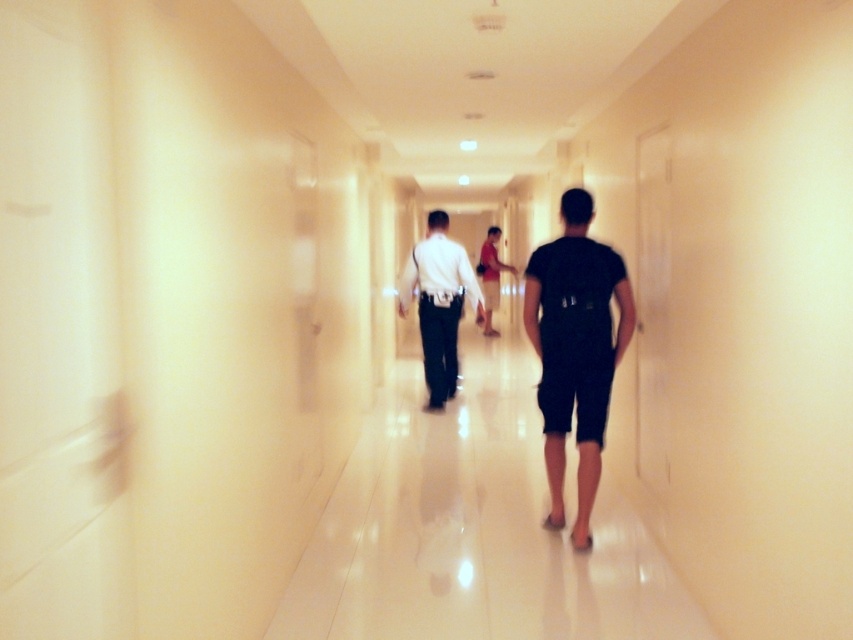
Is white glossy shirt at center wider than matte red shirt at center?

Correct, the width of white glossy shirt at center exceeds that of matte red shirt at center.

Between point (447, 259) and point (490, 289), which one is positioned behind?

Point (490, 289)

This screenshot has height=640, width=853. I want to click on white glossy shirt at center, so coord(439,304).

Which is above, black matte shorts at center or matte red shirt at center?

matte red shirt at center is higher up.

Is the position of black matte shorts at center less distant than that of matte red shirt at center?

Yes.

Between point (604, 353) and point (502, 262), which one is positioned behind?

Point (502, 262)

I want to click on black matte shorts at center, so click(x=575, y=349).

Which is behind, point (523, 312) or point (424, 314)?

Positioned behind is point (424, 314).

Consider the image. Between black matte shorts at center and white glossy shirt at center, which one has more height?

white glossy shirt at center

Who is more forward, (x=572, y=332) or (x=450, y=317)?

Point (x=572, y=332)

Where is `black matte shorts at center`? black matte shorts at center is located at coordinates [575, 349].